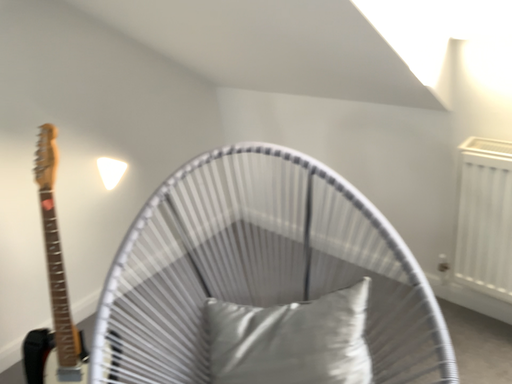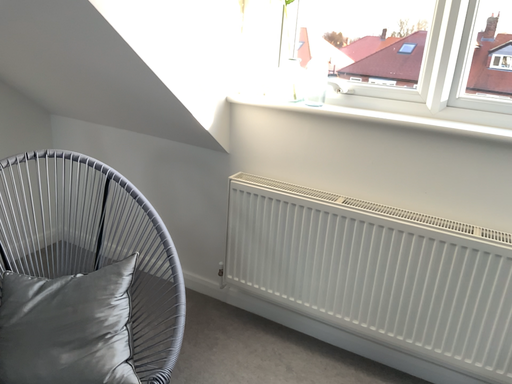
Question: How did the camera likely rotate when shooting the video?

Choices:
 (A) rotated right
 (B) rotated left

Answer: (A)